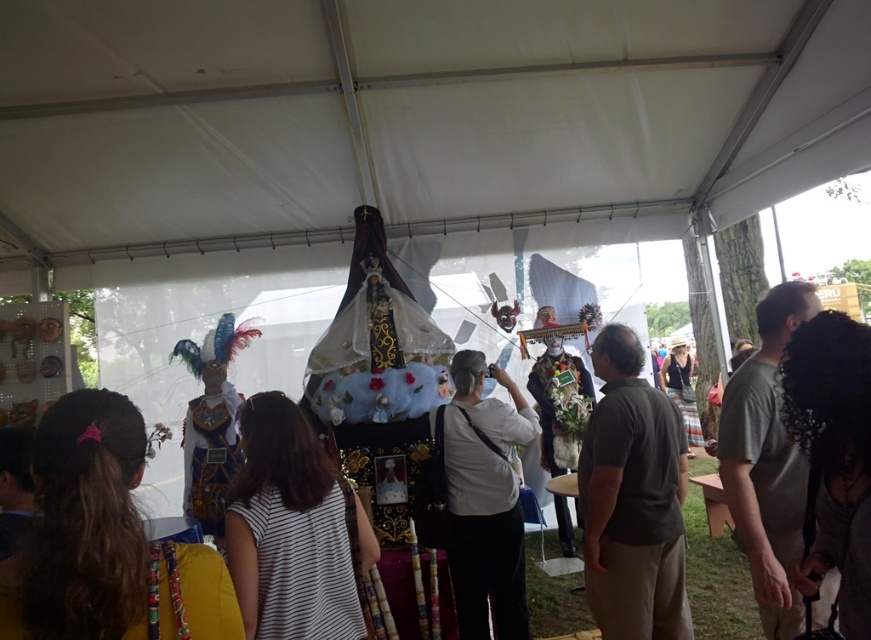
Question: Which object is positioned closest to the white fabric mask at center?

Choices:
 (A) white matte shirt at center
 (B) dark green shirt at center
 (C) gray cotton shirt at right
 (D) white fabric canopy at upper center

Answer: (B)

Question: Is white matte shirt at center above white fabric mask at center?

Choices:
 (A) yes
 (B) no

Answer: (A)

Question: Which of the following is the closest to the observer?

Choices:
 (A) white matte shirt at center
 (B) gray cotton shirt at right
 (C) dark green shirt at center

Answer: (B)

Question: Which object is positioned closest to the white fabric mask at center?

Choices:
 (A) dark green shirt at center
 (B) gray cotton shirt at right
 (C) white striped shirt at center

Answer: (A)

Question: Does white matte shirt at center lie behind gray cotton shirt at right?

Choices:
 (A) no
 (B) yes

Answer: (B)

Question: Is white striped shirt at center positioned in front of white matte shirt at center?

Choices:
 (A) no
 (B) yes

Answer: (B)